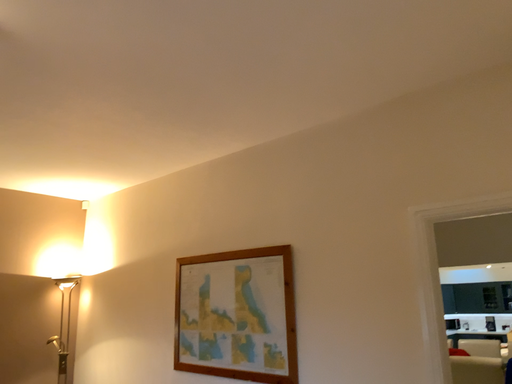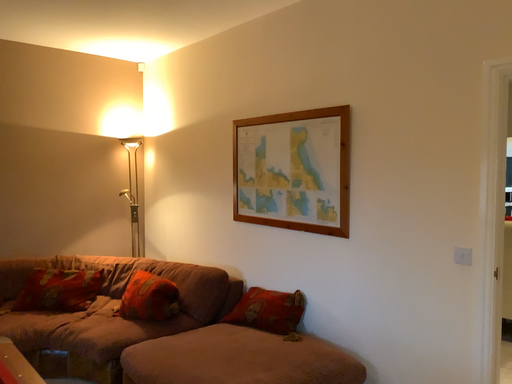
Question: How did the camera likely rotate when shooting the video?

Choices:
 (A) rotated downward
 (B) rotated upward

Answer: (A)